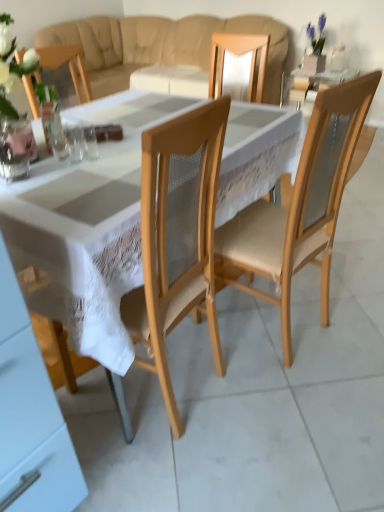
What are the coordinates of `free space between clear glass at center, marked as the 2th tableware in a left-to-right arrangement, and clear glass vase at lower left` in the screenshot? It's located at (47, 169).